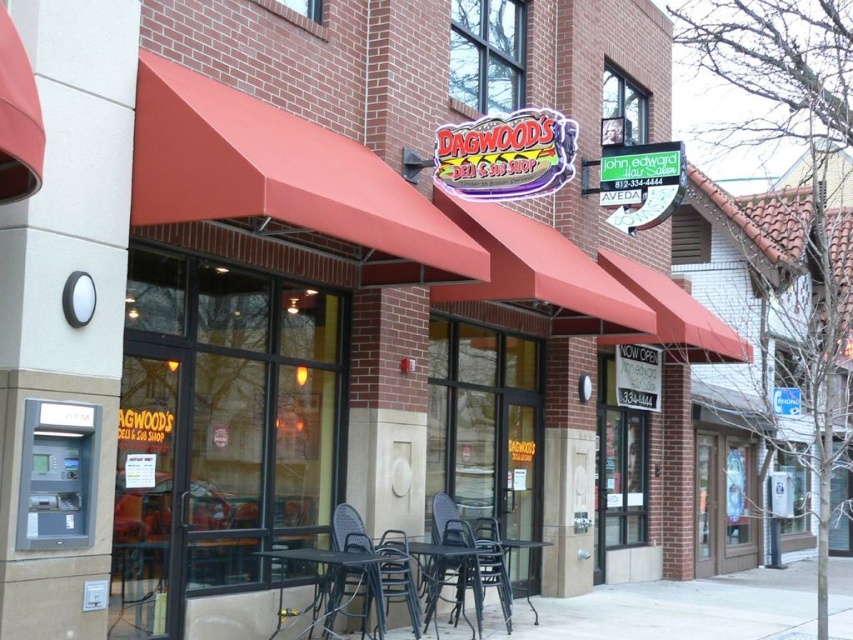
You are standing at the entrance of Dagwood Deli and Sub Shop. You see a rattan chair at lower center and John Edward Hair Salon sign. Which object is closer to you?

The rattan chair at lower center is closer to you since it is 7.30 meters away from John Edward Hair Salon sign, which is further away.

You are a customer standing at the entrance of Dagwood Deli and Sub Shop. You see a black plastic chair at center and a black metal table at lower center. Which object is closer to you?

The black plastic chair at center is closer to you because it is further to the viewer than the black metal table at lower center.